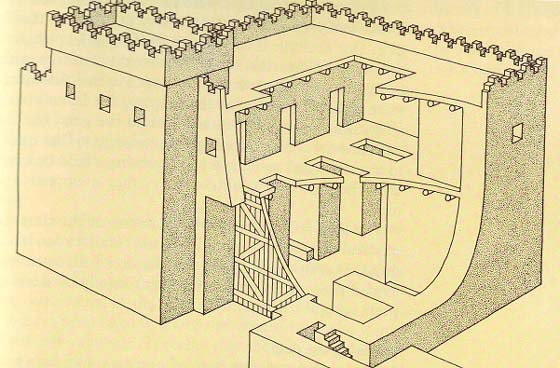
Find the location of a particular element. The image size is (560, 368). doorway is located at coordinates (292, 263), (343, 233), (334, 127), (288, 139).